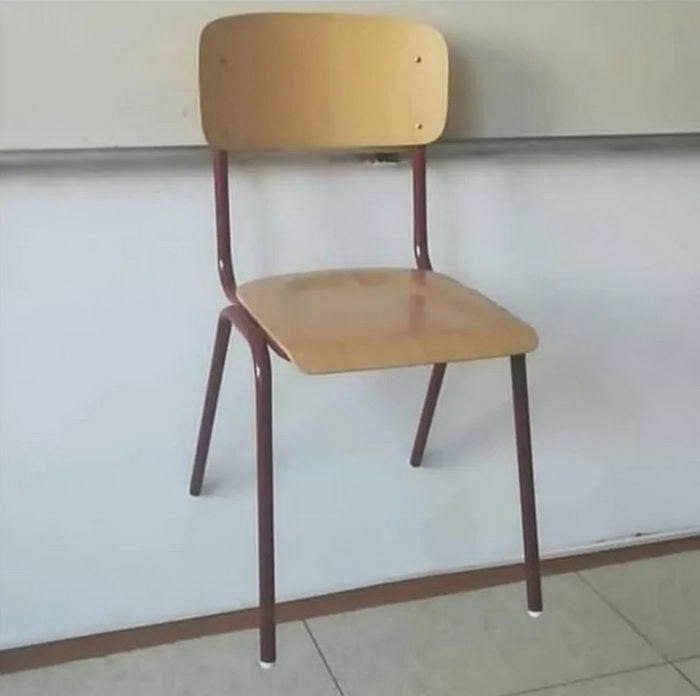
The height and width of the screenshot is (696, 700). What are the coordinates of `screws` in the screenshot? It's located at (420, 56), (419, 122), (223, 56), (223, 134).